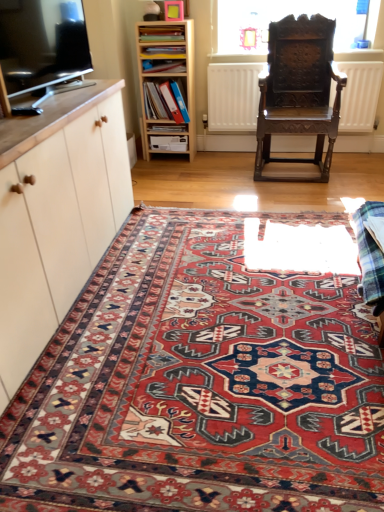
Image resolution: width=384 pixels, height=512 pixels. What are the coordinates of `free space behind plaid fabric at lower right` in the screenshot? It's located at (320, 252).